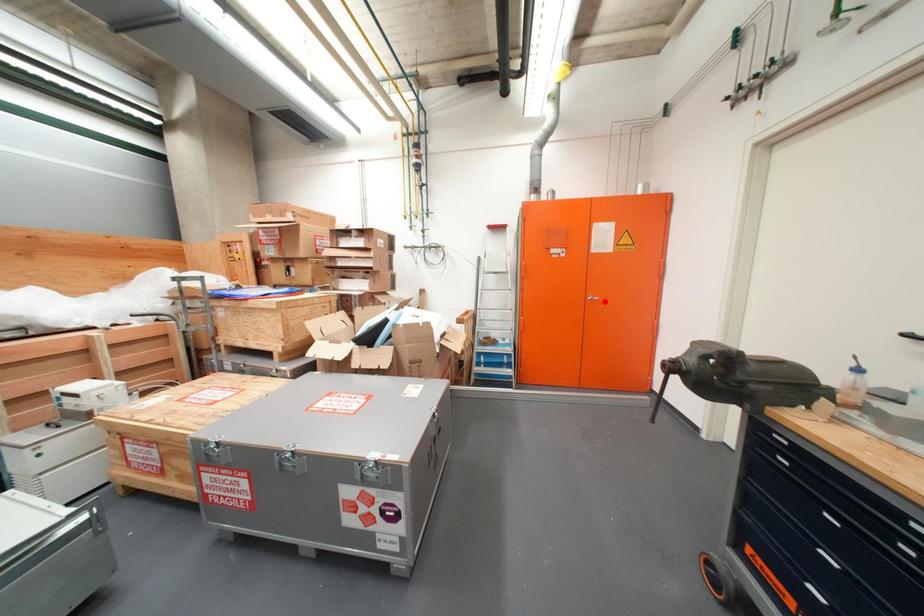
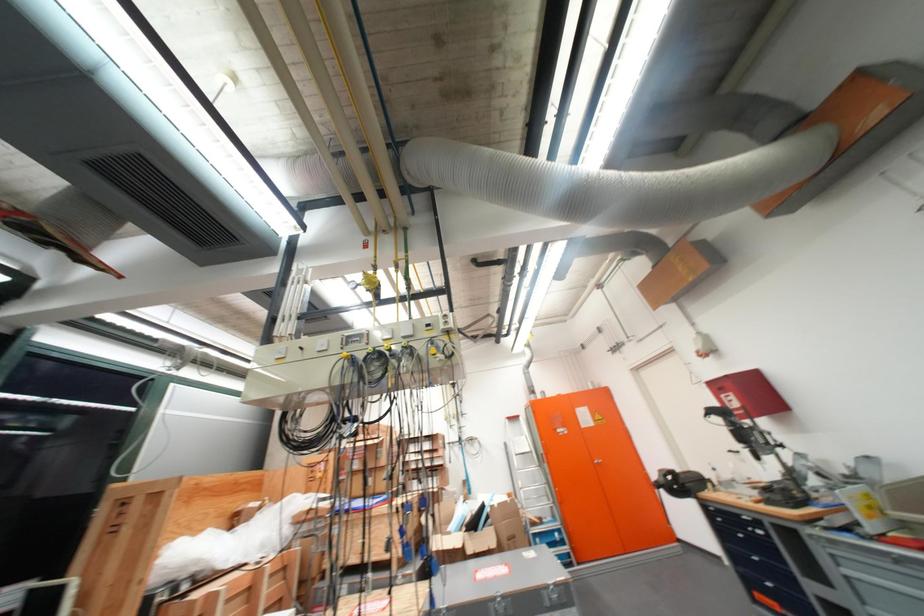
In the second image, find the point that corresponds to the highlighted location in the first image.

(611, 464)